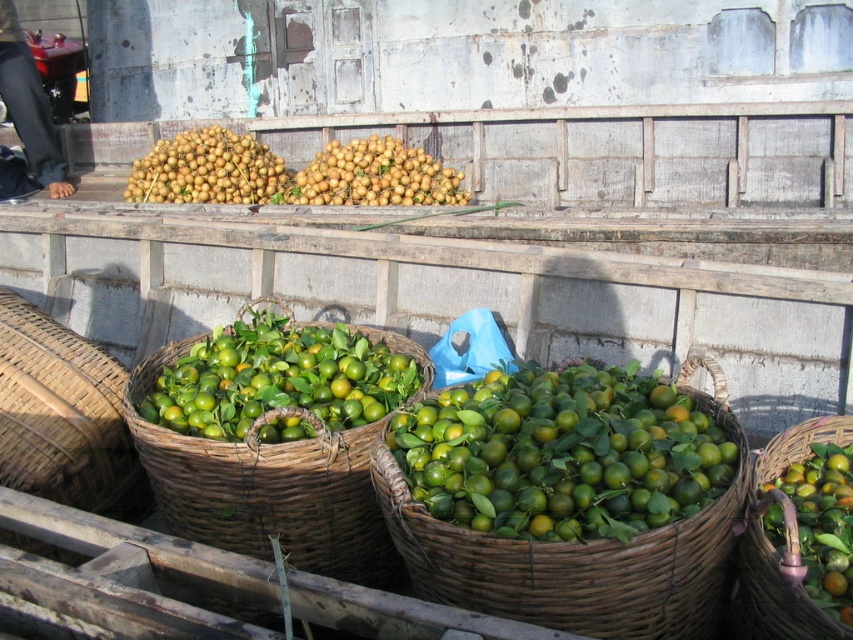
Question: Does green wicker basket at center come in front of smooth brown nuts at center?

Choices:
 (A) yes
 (B) no

Answer: (A)

Question: Among these objects, which one is nearest to the camera?

Choices:
 (A) brown matte longan at upper center
 (B) green wicker basket at center

Answer: (B)

Question: Which of these objects is positioned farthest from the green wicker basket at lower left?

Choices:
 (A) green matte citrus fruits at center
 (B) brown matte longan at upper center
 (C) green woven basket at lower right

Answer: (B)

Question: Is green matte citrus fruits at center smaller than green woven basket at lower right?

Choices:
 (A) no
 (B) yes

Answer: (A)

Question: Which of the following is the closest to the observer?

Choices:
 (A) green matte citrus fruits at center
 (B) green wicker basket at center
 (C) green wicker basket at lower left
 (D) smooth brown nuts at center

Answer: (B)

Question: Does green wicker basket at center have a lesser width compared to smooth brown nuts at center?

Choices:
 (A) yes
 (B) no

Answer: (A)